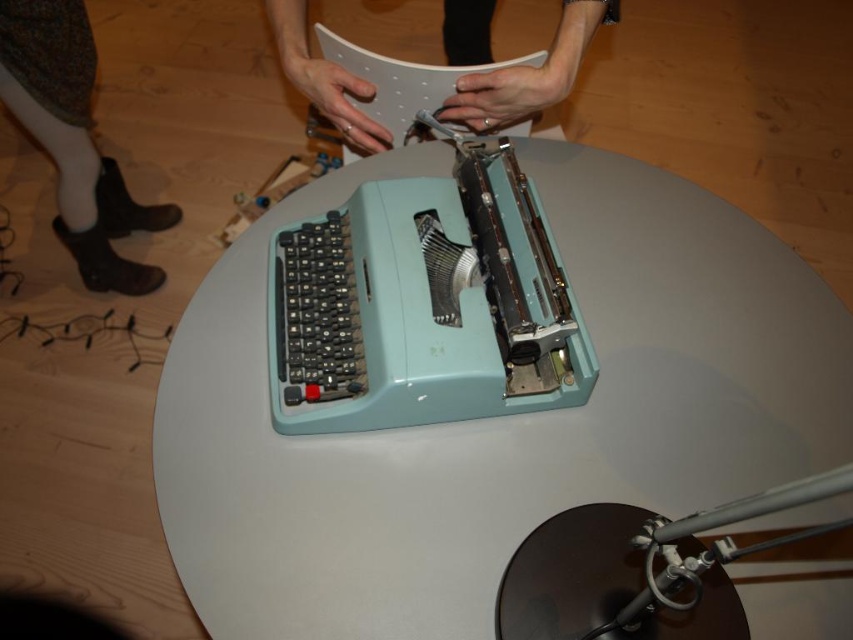
You are a delivery robot with a package that is 12 inches long. You need to place it between the light blue plastic typewriter at center and the matte white paper at center. Will the package fit in the space between them?

The distance between the light blue plastic typewriter at center and the matte white paper at center is 12.49 inches, so the 12 inch package will fit with a small amount of space remaining.

You are trying to determine if the light blue plastic typewriter at center can be placed on a shelf that is exactly the same height as the matte white paper at center. Based on the scene description, will the typewriter fit vertically on the shelf?

The light blue plastic typewriter at center is taller than matte white paper at center, so it will not fit vertically on the shelf that matches the paper height.